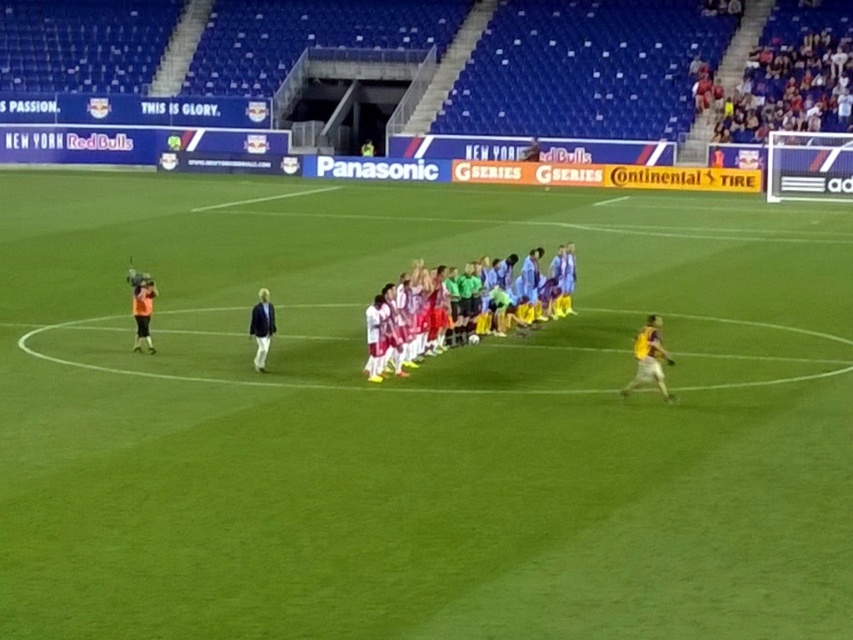
You are a soccer player standing at the point with coordinates point (257, 307). You need to pass the ball to a teammate located at point (651, 346). Considering the positions of the two points, which direction should you pass the ball to reach your teammate?

Since point (651, 346) is in front of point (257, 307), you should pass the ball forward towards point (651, 346) to reach your teammate.

You are a photographer at the soccer field. You want to take a photo of the white jersey at center and dark blue jacket at center. Which one will appear bigger in the photo?

The white jersey at center will appear bigger in the photo because it has a larger size compared to the dark blue jacket at center.

You are a soccer player standing at point (274, 332) during the pregame lineup. You need to move to the back of the line. Which direction should you move to reach the point (573, 250)?

You should move towards the point (573, 250), which is behind your current position at point (274, 332), to reach the back of the line.